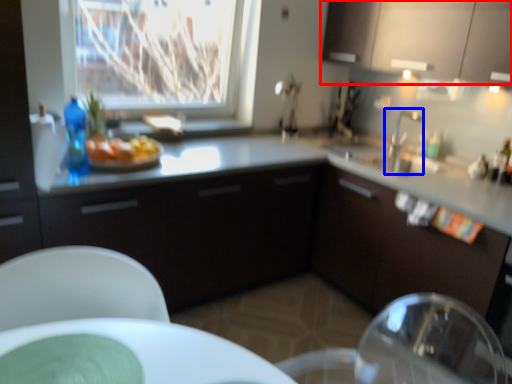
Question: Which point is closer to the camera, cabinetry (highlighted by a red box) or tap (highlighted by a blue box)?

Choices:
 (A) cabinetry
 (B) tap

Answer: (A)